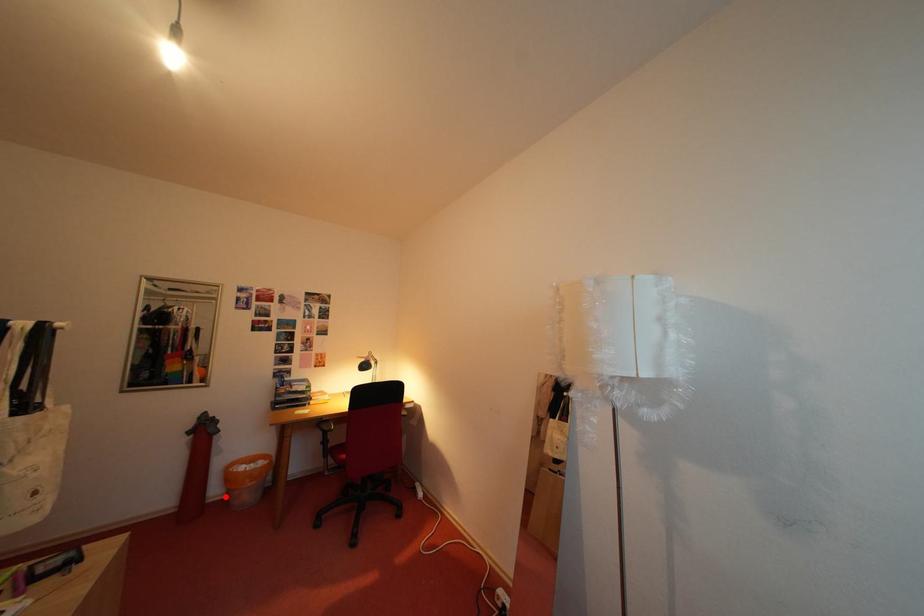
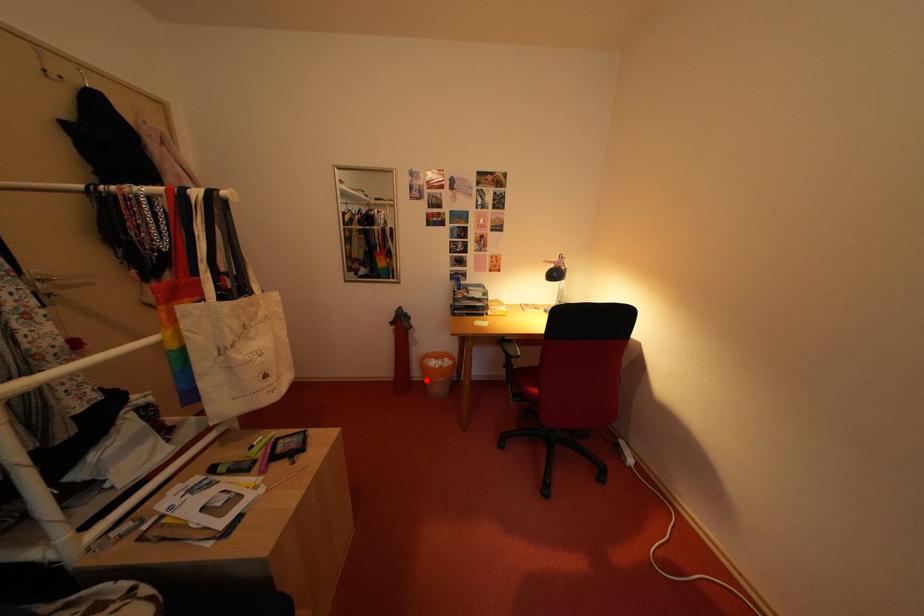
I am providing you with two images of the same scene from different viewpoints. A red point is marked on the first image and another point is marked on the second image. Is the marked point in image1 the same physical position as the marked point in image2?

Yes